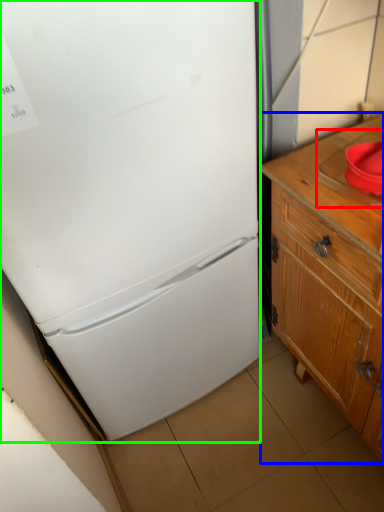
Question: Considering the real-world distances, which object is farthest from sink (highlighted by a red box)? cabinetry (highlighted by a blue box) or refrigerator (highlighted by a green box)?

Choices:
 (A) cabinetry
 (B) refrigerator

Answer: (B)